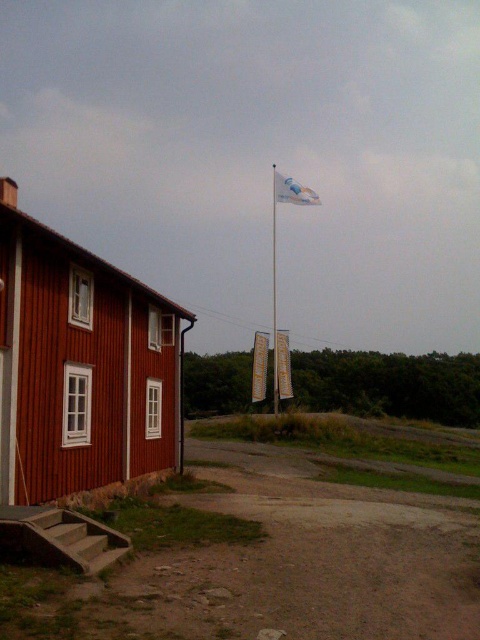
You are a delivery person trying to park your van in front of the building. The van is 2 meters wide. The yellow fabric banner at center and the yellow fabric sign at center are hanging from the same pole. Do you think the van can fit between them without touching either?

The yellow fabric banner at center might be wider than yellow fabric sign at center, but since the exact width difference isn not specified, it is uncertain if the 2 meter wide van can fit between them. Check the actual distance before parking.

You are standing at the entrance of the rustic wooden building and want to place a new yellow fabric sign at center. Currently, there is dirt at lower left in that area. Can you place the sign there without moving the dirt?

The dirt at lower left is to the left of the yellow fabric sign at center, so you can place the sign at the center without disturbing the dirt as they are positioned differently.